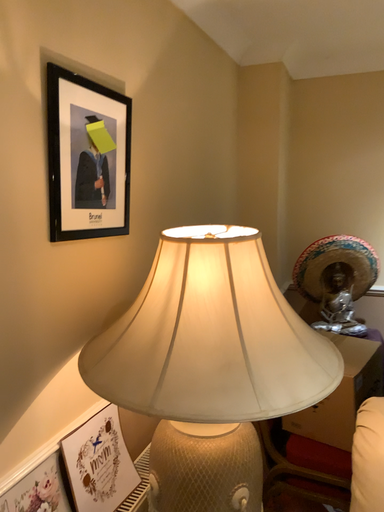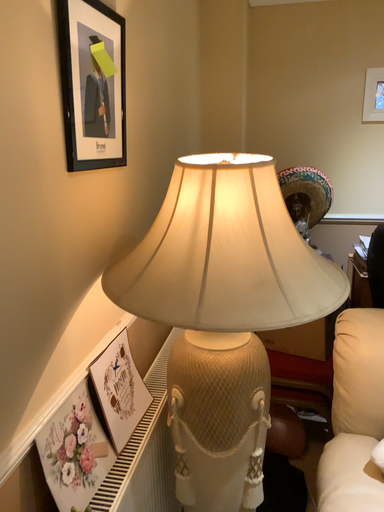
Question: How did the camera likely rotate when shooting the video?

Choices:
 (A) rotated upward
 (B) rotated downward

Answer: (B)